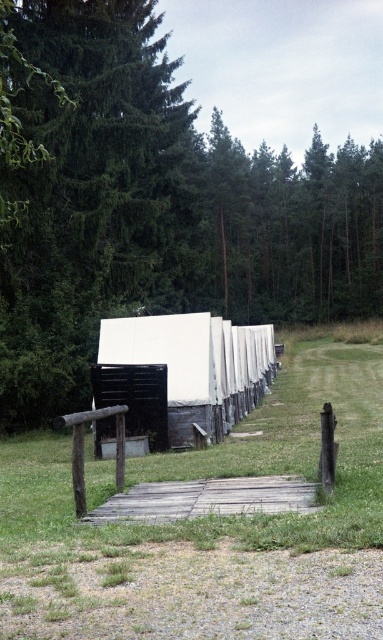
Question: Which point is farther to the camera?

Choices:
 (A) white matte tent at center
 (B) wooden plank at center
 (C) green leafy tree at upper left

Answer: (A)

Question: Does green leafy tree at upper left appear on the right side of white matte tent at center?

Choices:
 (A) yes
 (B) no

Answer: (A)

Question: Is green grass at center below white matte tent at center?

Choices:
 (A) yes
 (B) no

Answer: (A)

Question: Considering the real-world distances, which object is farthest from the wooden plank at center?

Choices:
 (A) green grass at center
 (B) green leafy tree at upper left

Answer: (B)

Question: Which object is positioned closest to the green leafy tree at upper left?

Choices:
 (A) white matte tent at center
 (B) green grass at center

Answer: (A)

Question: Can you confirm if green leafy tree at upper left is smaller than white matte tent at center?

Choices:
 (A) no
 (B) yes

Answer: (A)